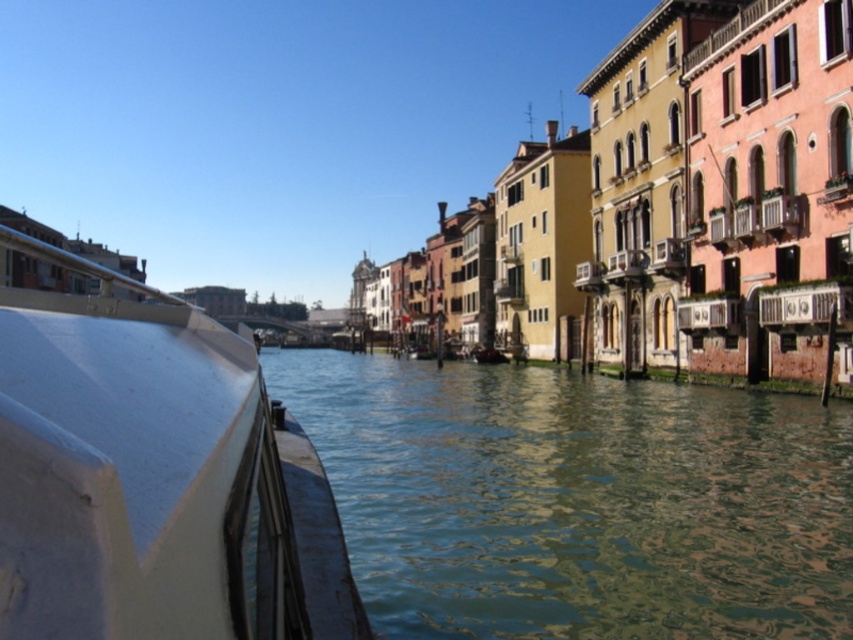
Question: Does greenish water at center have a greater width compared to white matte boat at left?

Choices:
 (A) no
 (B) yes

Answer: (B)

Question: Is greenish water at center positioned at the back of white matte boat at left?

Choices:
 (A) yes
 (B) no

Answer: (A)

Question: Is greenish water at center thinner than white matte boat at left?

Choices:
 (A) no
 (B) yes

Answer: (A)